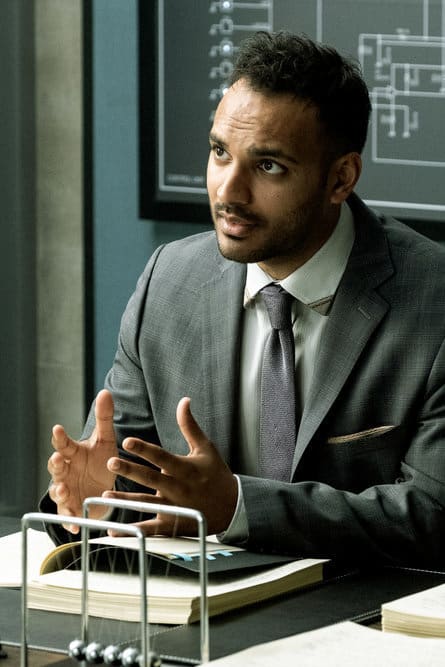
Identify the location of framed document. (190, 79).